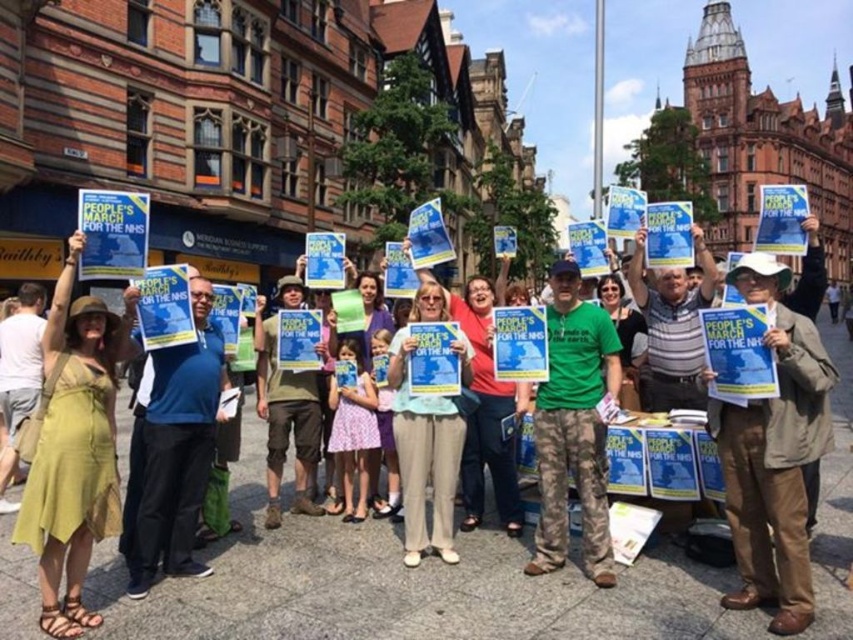
You are a photographer standing at the front of the crowd at the demonstration. You want to take a photo of both the light beige pants at center and the camouflage pants at center. Which pair of pants will appear larger in your photo?

The light beige pants at center will appear larger in the photo because it is closer to the viewer than the camouflage pants at center.

You are a photographer standing at point 0.0, 0.0 in the image coordinate system. You want to capture a photo of the brown leather jacket at center located at point (775, 454). What direction should you move to get closer to the jacket?

The brown leather jacket at center is located at point (775, 454). Since you are at point 0.0, 0.0, you should move towards the positive x and y directions to reach the jacket.

In the scene of the public demonstration for the NHS, there is a person wearing a blue fabric shirt at center and light beige pants at center. Which clothing item is taller?

The blue fabric shirt at center is taller than the light beige pants at center.